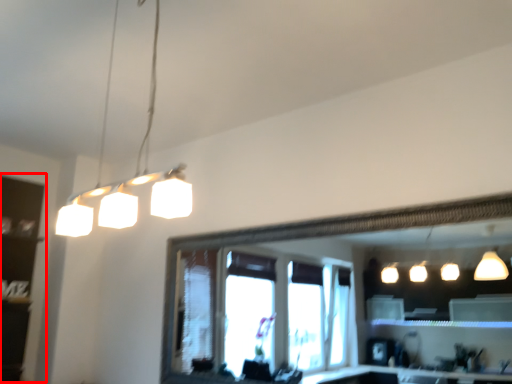
Question: From the image, what is the correct spatial relationship of shelf (annotated by the red box) in relation to lamp?

Choices:
 (A) right
 (B) left

Answer: (B)